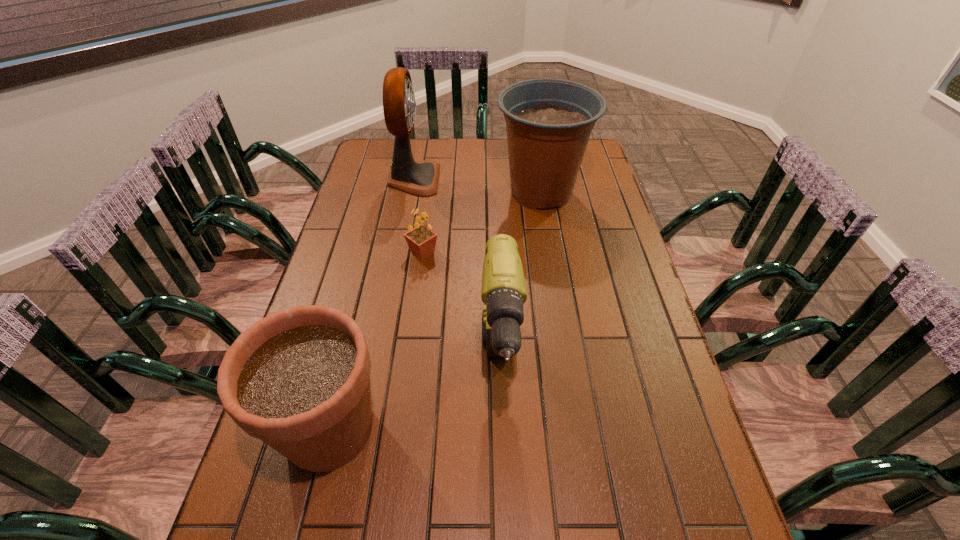
Identify the location of free space located on the handle side of the drill. The image size is (960, 540). (503, 475).

Locate an element on the screen. This screenshot has height=540, width=960. vacant space located on the right of the shorter flowerpot is located at coordinates (543, 429).

Locate an element on the screen. vacant space situated at the front of the sunflower with flowers visible is located at coordinates (524, 253).

I want to click on fan that is positioned at the far edge, so click(420, 178).

This screenshot has width=960, height=540. I want to click on flowerpot at the far edge, so click(x=549, y=121).

Locate an element on the screen. This screenshot has width=960, height=540. fan that is positioned at the left edge is located at coordinates (420, 178).

Locate an element on the screen. This screenshot has width=960, height=540. flowerpot that is at the left edge is located at coordinates (299, 379).

Find the location of a particular element. The image size is (960, 540). object situated at the right edge is located at coordinates (549, 121).

Identify the location of object that is at the far left corner. (420, 178).

I want to click on object at the far right corner, so click(x=549, y=121).